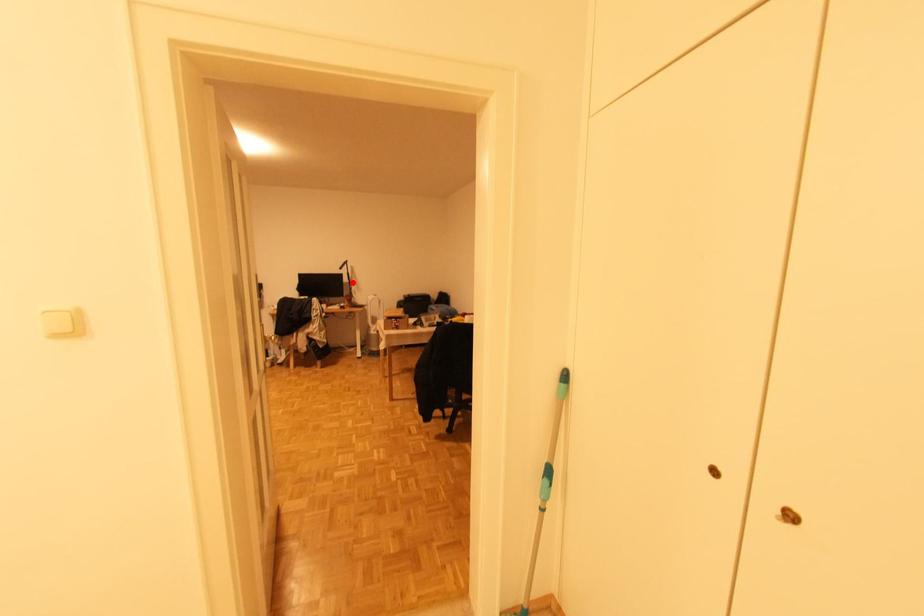
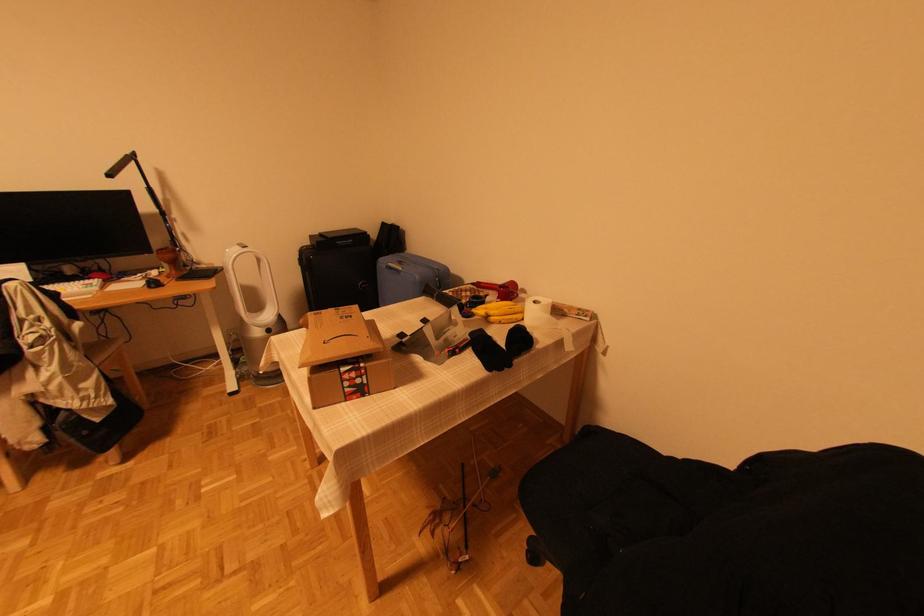
Where in the second image is the point corresponding to the highlighted location from the first image?

(166, 215)